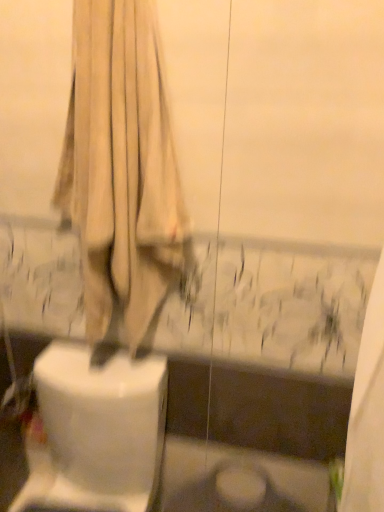
Question: Is the depth of beige fabric curtain at upper center less than that of white glossy toilet at lower left?

Choices:
 (A) yes
 (B) no

Answer: (A)

Question: Considering the relative positions of beige fabric curtain at upper center and white glossy toilet at lower left in the image provided, is beige fabric curtain at upper center to the left of white glossy toilet at lower left from the viewer's perspective?

Choices:
 (A) yes
 (B) no

Answer: (B)

Question: From a real-world perspective, does beige fabric curtain at upper center sit lower than white glossy toilet at lower left?

Choices:
 (A) yes
 (B) no

Answer: (B)

Question: Can you confirm if beige fabric curtain at upper center is smaller than white glossy toilet at lower left?

Choices:
 (A) no
 (B) yes

Answer: (B)

Question: From the image's perspective, is beige fabric curtain at upper center located beneath white glossy toilet at lower left?

Choices:
 (A) yes
 (B) no

Answer: (B)

Question: Does beige fabric curtain at upper center turn towards white glossy toilet at lower left?

Choices:
 (A) no
 (B) yes

Answer: (A)

Question: Is white glossy toilet at lower left to the left of beige fabric curtain at upper center from the viewer's perspective?

Choices:
 (A) yes
 (B) no

Answer: (A)

Question: Does white glossy toilet at lower left have a smaller size compared to beige fabric curtain at upper center?

Choices:
 (A) no
 (B) yes

Answer: (A)

Question: From a real-world perspective, is white glossy toilet at lower left under beige fabric curtain at upper center?

Choices:
 (A) no
 (B) yes

Answer: (B)

Question: Is white glossy toilet at lower left thinner than beige fabric curtain at upper center?

Choices:
 (A) yes
 (B) no

Answer: (B)

Question: From the image's perspective, is white glossy toilet at lower left beneath beige fabric curtain at upper center?

Choices:
 (A) no
 (B) yes

Answer: (B)

Question: Can you see white glossy toilet at lower left touching beige fabric curtain at upper center?

Choices:
 (A) yes
 (B) no

Answer: (B)

Question: Is white glossy toilet at lower left wider or thinner than beige fabric curtain at upper center?

Choices:
 (A) wide
 (B) thin

Answer: (A)